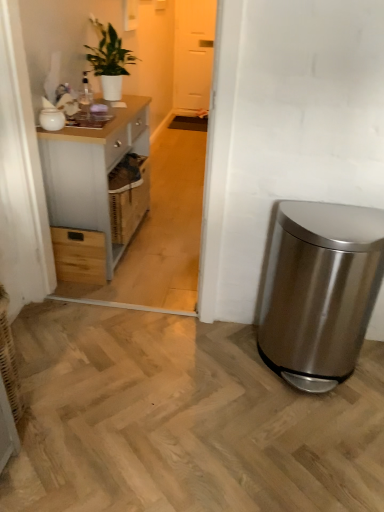
At what (x,y) coordinates should I click in order to perform the action: click on free spot to the right of white glossy jar at upper left. Please return your answer as a coordinate pair (x, y). This screenshot has width=384, height=512. Looking at the image, I should click on (91, 128).